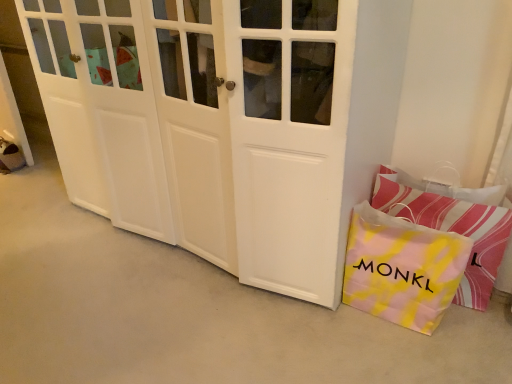
You are a GUI agent. You are given a task and a screenshot of the screen. Output one action in this format:
    pyautogui.click(x=<x>, y=<y>)
    Task: Click on the free space in front of white matte door at center
    The image size is (512, 384).
    Given the screenshot: What is the action you would take?
    pyautogui.click(x=180, y=324)